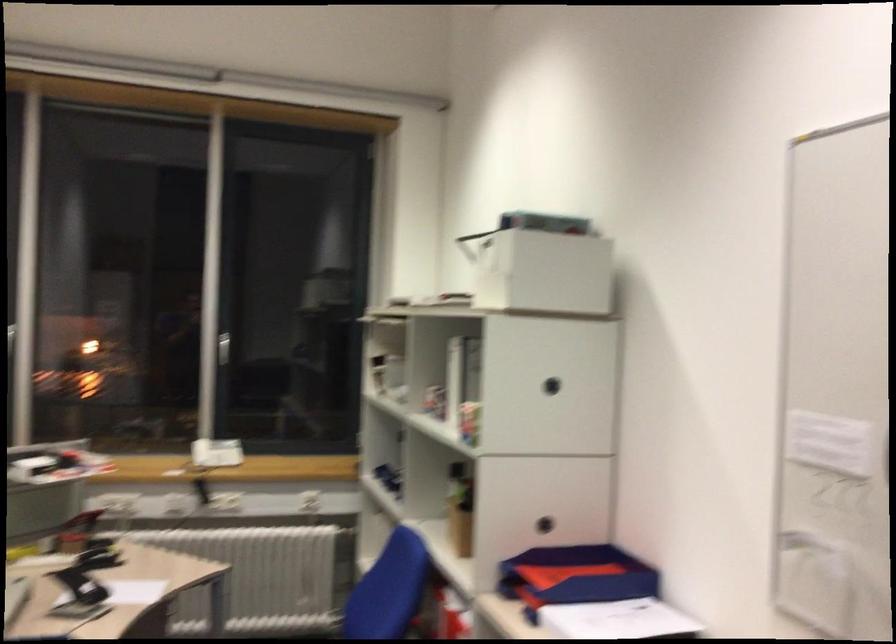
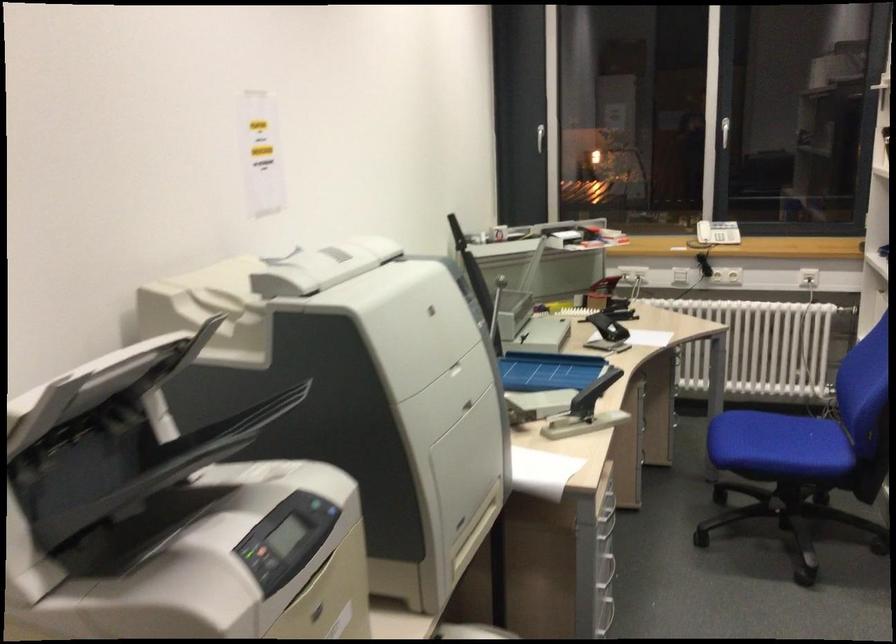
Question: How did the camera likely rotate?

Choices:
 (A) Left
 (B) Right
 (C) Up
 (D) Down

Answer: (A)